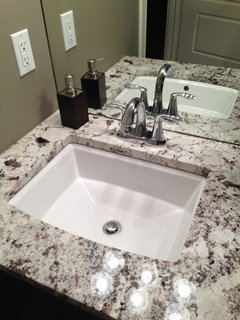
Where is `handles`? handles is located at coordinates (159, 119), (111, 105).